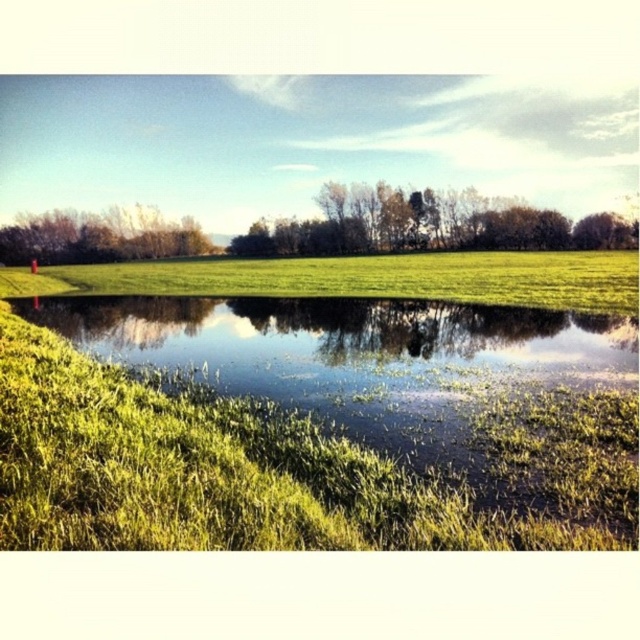
Between point (522, 292) and point (250, 248), which one is positioned in front?

Point (522, 292) is more forward.

This screenshot has height=640, width=640. Identify the location of green grassy field at center. (365, 278).

Locate an element on the screen. The height and width of the screenshot is (640, 640). green grassy field at center is located at coordinates (365, 278).

Is point (465, 227) less distant than point (186, 252)?

Yes, it is in front of point (186, 252).

From the picture: How distant is green leafy trees at center from brown leafy trees at upper left?

green leafy trees at center and brown leafy trees at upper left are 29.29 meters apart from each other.

Find the location of a particular element. The image size is (640, 640). green leafy trees at center is located at coordinates (428, 225).

Is green grassy field at center to the right of brown leafy trees at upper left from the viewer's perspective?

Indeed, green grassy field at center is positioned on the right side of brown leafy trees at upper left.

Is green grassy field at center wider than brown leafy trees at upper left?

Yes.

Image resolution: width=640 pixels, height=640 pixels. What are the coordinates of `green grassy field at center` in the screenshot? It's located at (365, 278).